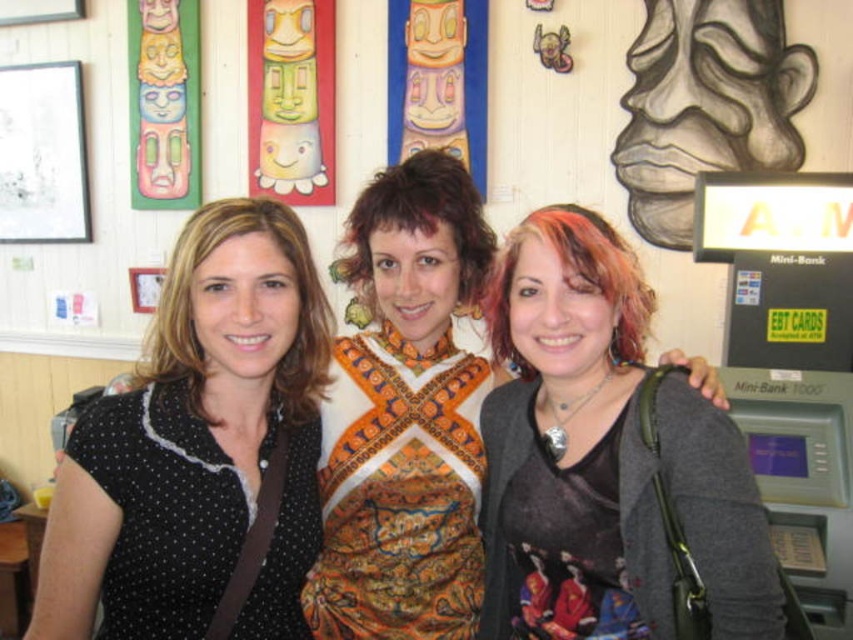
You are a photographer setting up for a group photo. You notice the matte black purse at center and the black dotted shirt at left in the scene. Which object is positioned lower in the image?

The matte black purse at center is located below the black dotted shirt at left, so it is positioned lower in the image.

You are standing in front of the three women in the image. The black dotted shirt at left is part of the woman on the left. If you want to hand her a gift card that is 4 inches long, will it reach her without needing to move closer or farther away?

The black dotted shirt at left and viewer are 38.06 inches apart from each other. Since the gift card is only 4 inches long, it can easily reach her without needing to move closer or farther away.

You are standing at the center of the room and looking towards the wall. There are two points marked in the image. Which point, point (701,428) or point (51,576), is closer to you?

Point (51,576) is closer to you because it is in front of point (701,428).